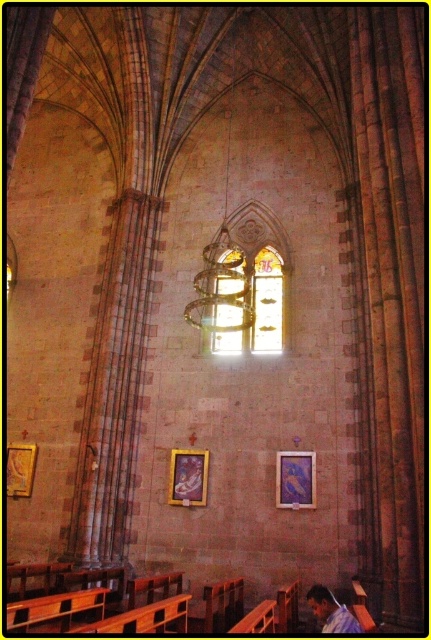
Consider the image. Between matte gold picture frame at center and gold-framed painting at center, which one is positioned higher?

matte gold picture frame at center is above.

Who is taller, matte gold picture frame at center or gold-framed painting at center?

Standing taller between the two is gold-framed painting at center.

Locate an element on the screen. The width and height of the screenshot is (431, 640). matte gold picture frame at center is located at coordinates (296, 480).

Does gold-framed painting at center have a greater width compared to gold-framed picture at left?

Incorrect, gold-framed painting at center's width does not surpass gold-framed picture at left's.

Is point (178, 483) closer to camera compared to point (31, 461)?

Yes.

You are a GUI agent. You are given a task and a screenshot of the screen. Output one action in this format:
    pyautogui.click(x=<x>, y=<y>)
    Task: Click on the gold-framed painting at center
    
    Given the screenshot: What is the action you would take?
    pyautogui.click(x=187, y=477)

Does matte gold picture frame at center have a greater width compared to gold-framed picture at left?

Incorrect, matte gold picture frame at center's width does not surpass gold-framed picture at left's.

Can you confirm if matte gold picture frame at center is positioned to the left of gold-framed picture at left?

No, matte gold picture frame at center is not to the left of gold-framed picture at left.

Is point (290, 506) positioned before point (15, 460)?

Yes, it is in front of point (15, 460).

Identify the location of matte gold picture frame at center. (296, 480).